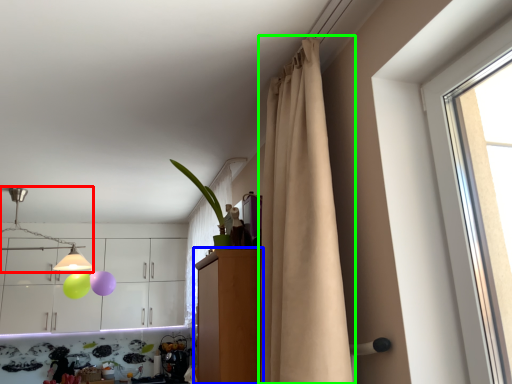
Question: Based on their relative distances, which object is farther from lamp (highlighted by a red box)? Choose from dresser (highlighted by a blue box) and curtain (highlighted by a green box).

Choices:
 (A) dresser
 (B) curtain

Answer: (B)